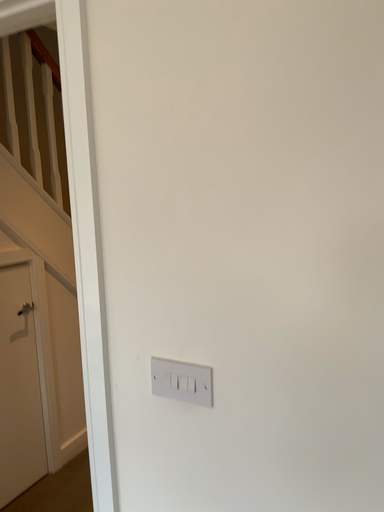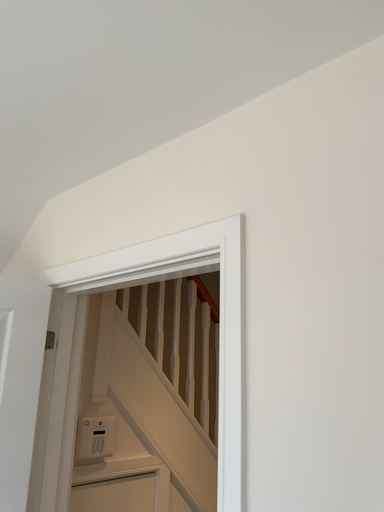
Question: How did the camera likely rotate when shooting the video?

Choices:
 (A) rotated right
 (B) rotated left

Answer: (B)